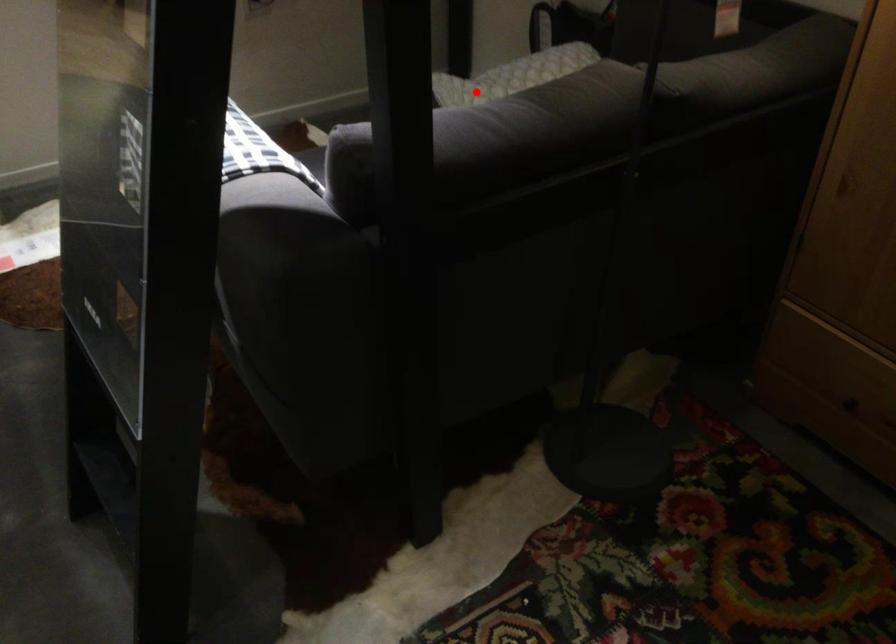
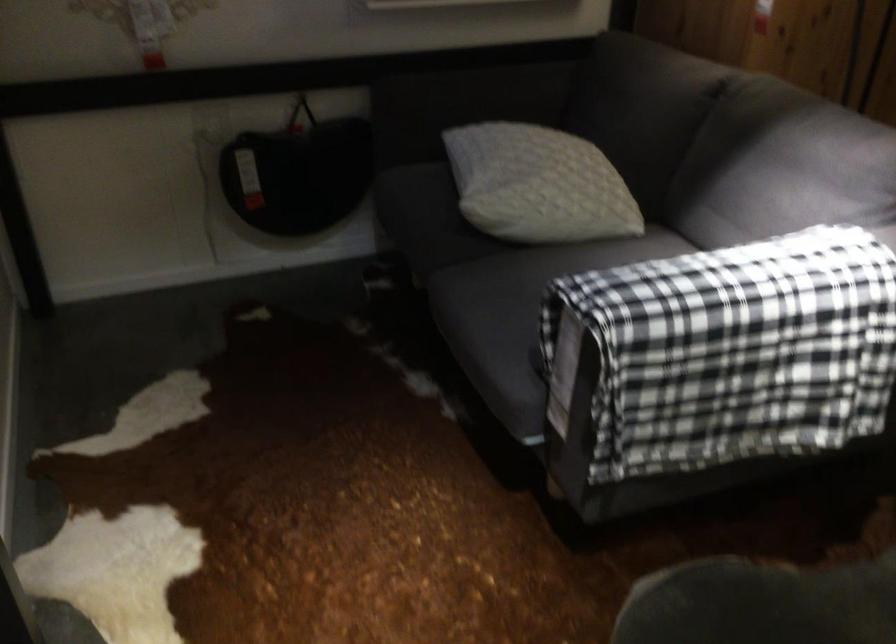
Where in the second image is the point corresponding to the highlighted location from the first image?

(538, 185)